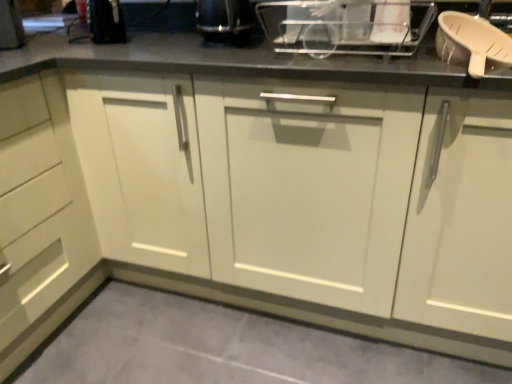
Locate an element on the screen. vacant area that is in front of white plastic dish rack at upper center, the second appliance viewed from the left is located at coordinates (384, 62).